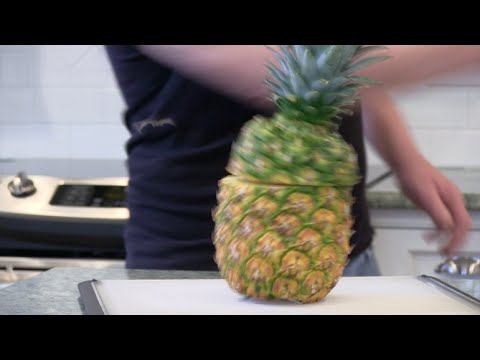
At what (x,y) coordinates should I click in order to perform the action: click on cupboard. Please return your answer as a coordinate pair (x, y). This screenshot has height=360, width=480. Looking at the image, I should click on (x=19, y=266), (x=396, y=243), (x=396, y=221).